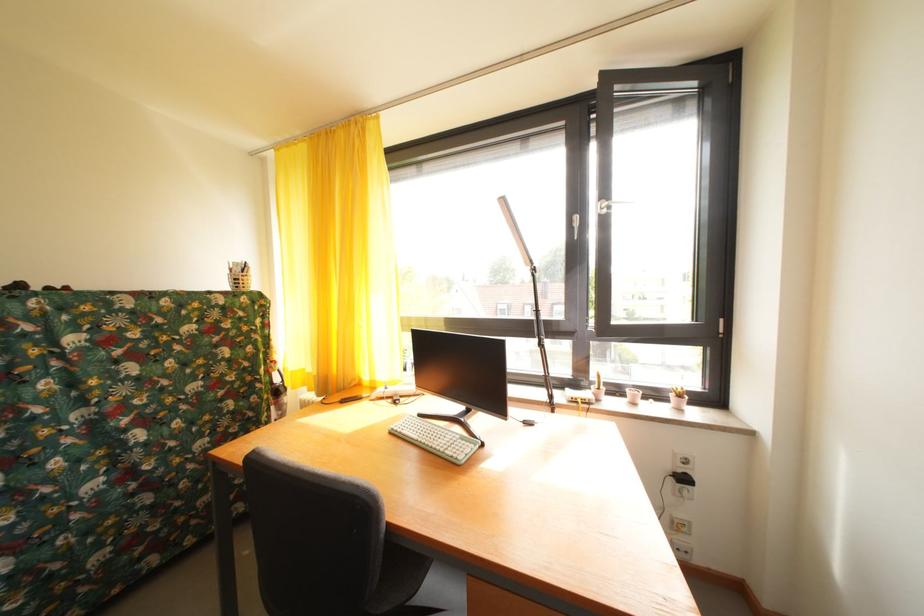
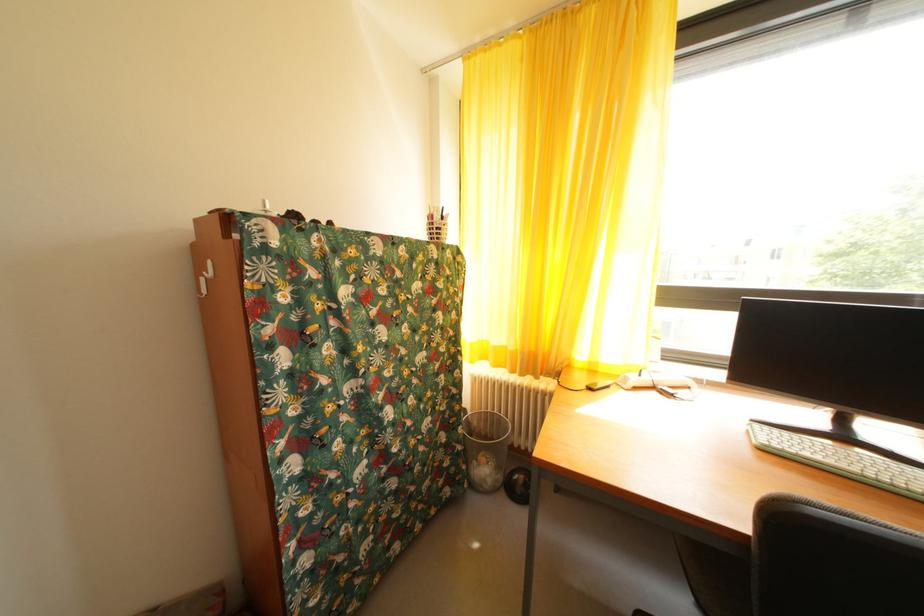
Locate, in the second image, the point that corresponds to pixel 424 442 in the first image.

(854, 472)